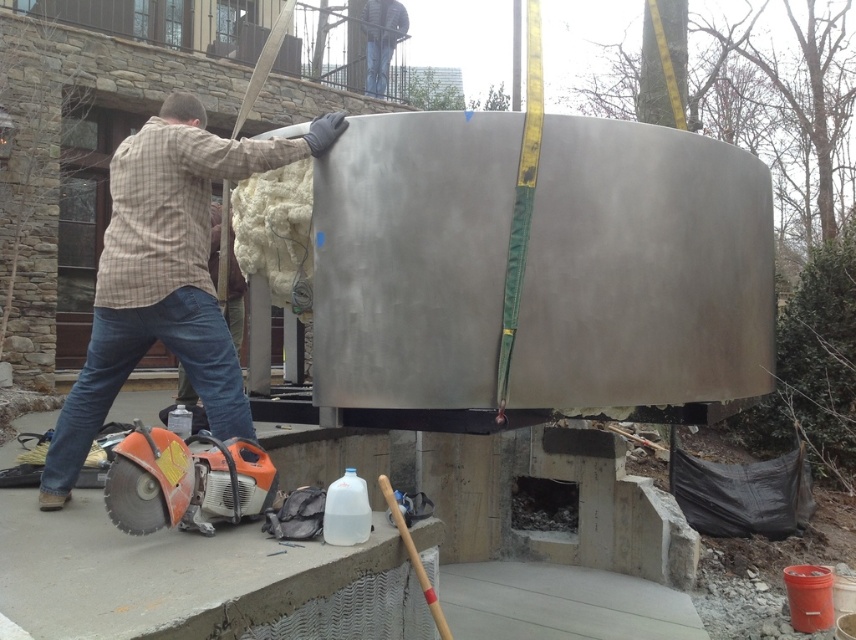
Question: Which object appears farthest from the camera in this image?

Choices:
 (A) plaid shirt at left
 (B) orange plastic circular saw at lower left

Answer: (A)

Question: Does plaid shirt at left have a greater width compared to orange plastic circular saw at lower left?

Choices:
 (A) no
 (B) yes

Answer: (B)

Question: Which object appears farthest from the camera in this image?

Choices:
 (A) orange plastic circular saw at lower left
 (B) plaid shirt at left

Answer: (B)

Question: From the image, what is the correct spatial relationship of plaid shirt at left in relation to orange plastic circular saw at lower left?

Choices:
 (A) right
 (B) left

Answer: (B)

Question: Can you confirm if plaid shirt at left is positioned to the right of orange plastic circular saw at lower left?

Choices:
 (A) no
 (B) yes

Answer: (A)